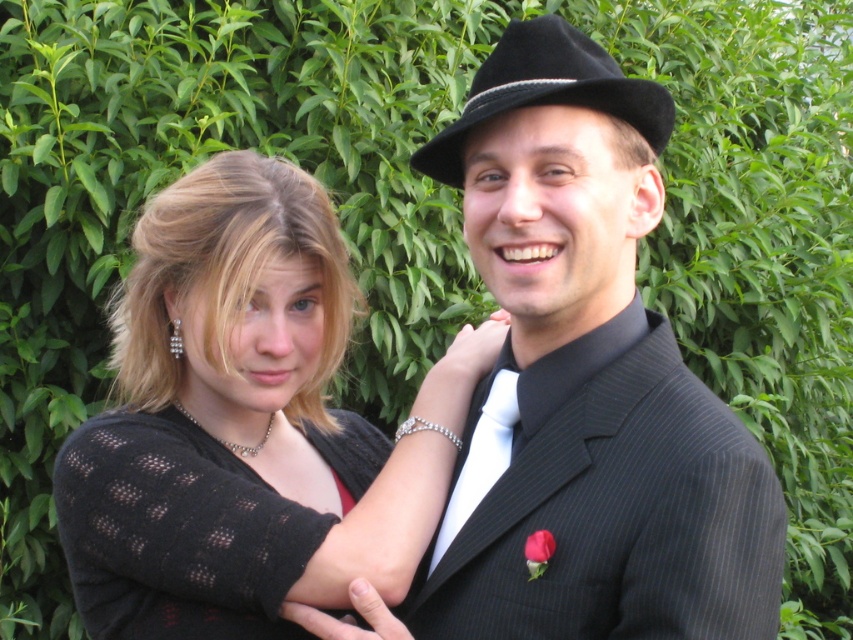
Question: Among these points, which one is nearest to the camera?

Choices:
 (A) (169, 449)
 (B) (161, 541)
 (C) (496, 566)
 (D) (497, 474)

Answer: (C)

Question: Is the position of black felt fedora at upper right less distant than that of white satin tie at center?

Choices:
 (A) no
 (B) yes

Answer: (B)

Question: Is black textured sweater at left closer to the viewer compared to black felt fedora at upper right?

Choices:
 (A) yes
 (B) no

Answer: (B)

Question: Which object is the closest to the black pinstripe suit at center?

Choices:
 (A) black textured sweater at left
 (B) white satin tie at center
 (C) black felt fedora at upper right

Answer: (B)

Question: Among these points, which one is nearest to the camera?

Choices:
 (A) [254, 477]
 (B) [502, 396]
 (C) [367, 424]
 (D) [492, 612]

Answer: (D)

Question: Considering the relative positions of black pinstripe suit at center and black textured sweater at left in the image provided, where is black pinstripe suit at center located with respect to black textured sweater at left?

Choices:
 (A) left
 (B) right

Answer: (B)